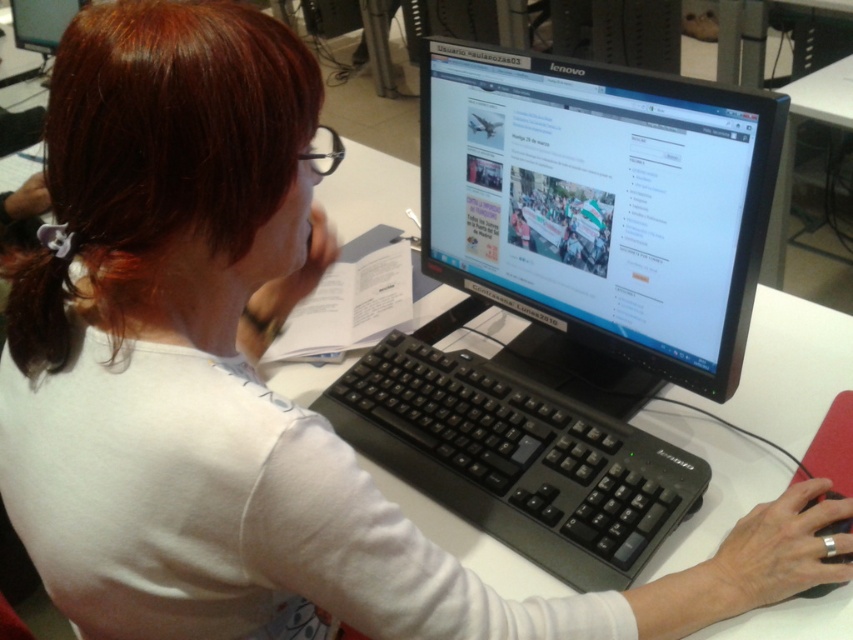
Question: Which of the following is the farthest from the observer?

Choices:
 (A) black plastic keyboard at center
 (B) black glossy monitor at center

Answer: (A)

Question: Estimate the real-world distances between objects in this image. Which object is farther from the matte black monitor at upper center?

Choices:
 (A) black glossy monitor at center
 (B) black plastic keyboard at center

Answer: (B)

Question: In this image, where is black glossy monitor at center located relative to black plastic keyboard at center?

Choices:
 (A) below
 (B) above

Answer: (B)

Question: Can you confirm if black plastic keyboard at center is positioned to the left of matte black monitor at upper center?

Choices:
 (A) no
 (B) yes

Answer: (A)

Question: Which point is closer to the camera?

Choices:
 (A) (746, 150)
 (B) (39, 17)

Answer: (A)

Question: Is black glossy monitor at center bigger than matte black monitor at upper center?

Choices:
 (A) yes
 (B) no

Answer: (A)